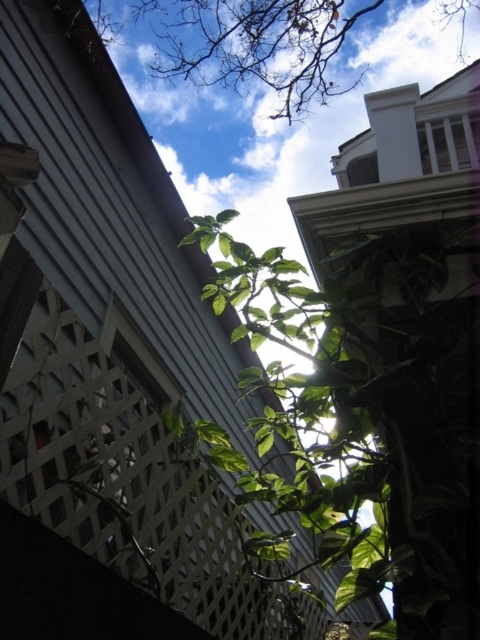
Describe the element at coordinates (122, 477) in the screenshot. I see `white lattice fence at upper center` at that location.

Is point (211, 618) positioned in front of point (200, 35)?

Yes.

Identify the location of white lattice fence at upper center. (122, 477).

Locate an element on the screen. This screenshot has width=480, height=640. white lattice fence at upper center is located at coordinates (122, 477).